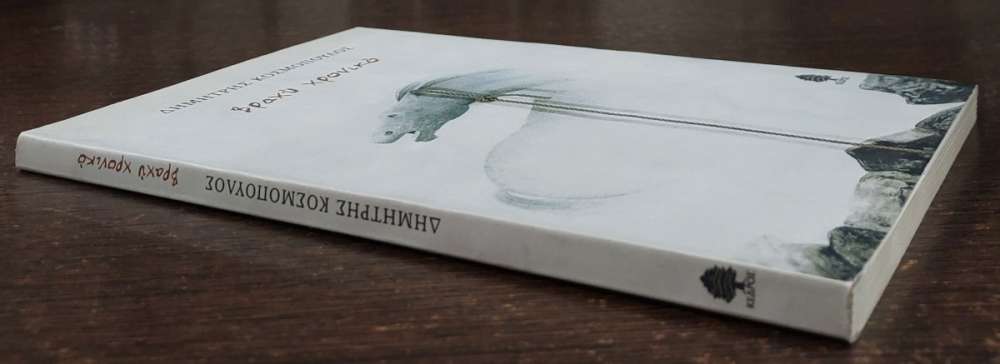
Where is `table`? The width and height of the screenshot is (1000, 364). table is located at coordinates (384, 274).